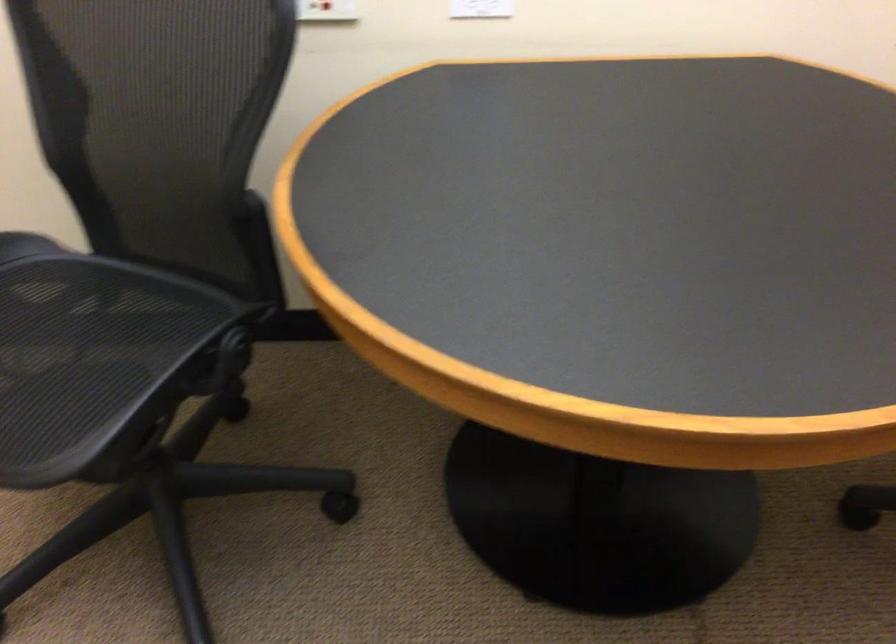
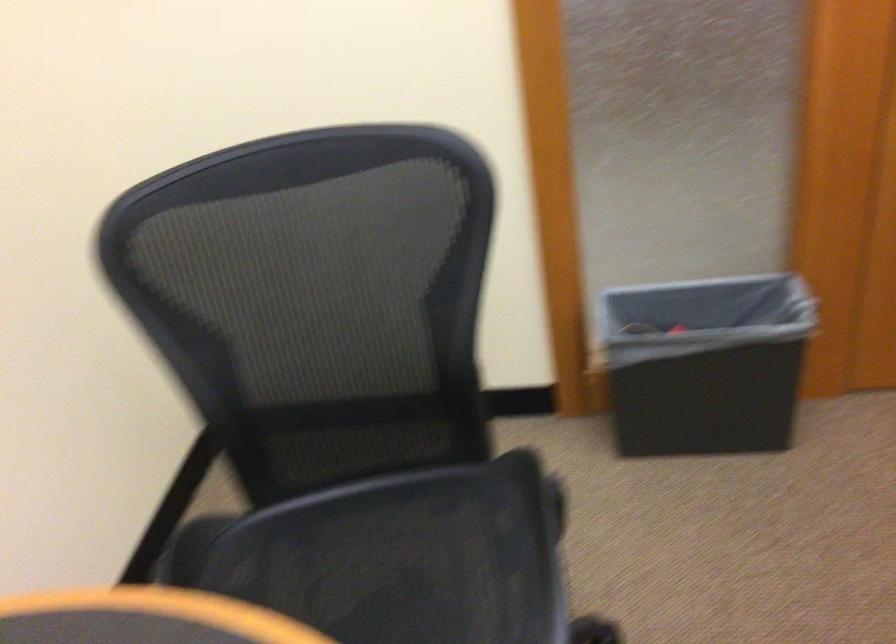
The first image is from the beginning of the video and the second image is from the end. How did the camera likely rotate when shooting the video?

The rotation direction of the camera is right-down.